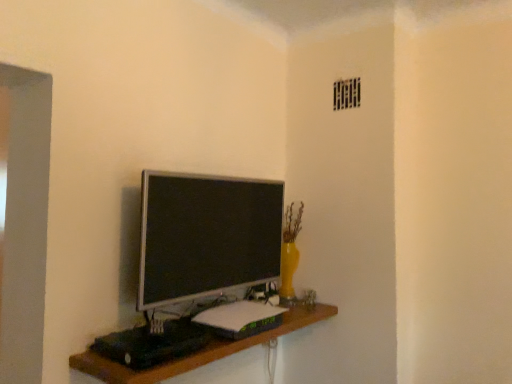
Measure the distance between point (120, 373) and camera.

They are 1.13 meters apart.

What is the approximate height of wooden shelf at center?

wooden shelf at center is 22.27 centimeters in height.

What do you see at coordinates (198, 351) in the screenshot? This screenshot has height=384, width=512. I see `wooden shelf at center` at bounding box center [198, 351].

Where is `wooden shelf at center`? wooden shelf at center is located at coordinates (198, 351).

What is the approximate width of satin silver monitor at center?

6.87 inches.

The height and width of the screenshot is (384, 512). Describe the element at coordinates (206, 236) in the screenshot. I see `satin silver monitor at center` at that location.

Where is `satin silver monitor at center`? The height and width of the screenshot is (384, 512). satin silver monitor at center is located at coordinates (206, 236).

Locate an element on the screen. Image resolution: width=512 pixels, height=384 pixels. wooden shelf at center is located at coordinates (198, 351).

Based on their positions, is wooden shelf at center located to the left or right of satin silver monitor at center?

From the image, it's evident that wooden shelf at center is to the right of satin silver monitor at center.

Looking at this image, relative to satin silver monitor at center, is wooden shelf at center in front or behind?

Clearly, wooden shelf at center is in front of satin silver monitor at center.

Which is closer to the camera, (113, 380) or (194, 200)?

Point (113, 380) is closer to the camera than point (194, 200).

From the image's perspective, does wooden shelf at center appear lower than satin silver monitor at center?

Yes.

From a real-world perspective, who is located lower, wooden shelf at center or satin silver monitor at center?

wooden shelf at center is physically lower.

Is wooden shelf at center thinner than satin silver monitor at center?

No, wooden shelf at center is not thinner than satin silver monitor at center.

Can you confirm if wooden shelf at center is taller than satin silver monitor at center?

No.

Considering the relative sizes of wooden shelf at center and satin silver monitor at center in the image provided, is wooden shelf at center smaller than satin silver monitor at center?

Actually, wooden shelf at center might be larger than satin silver monitor at center.

Is wooden shelf at center spatially inside satin silver monitor at center, or outside of it?

wooden shelf at center lies outside satin silver monitor at center.

Is wooden shelf at center positioned far away from satin silver monitor at center?

No, wooden shelf at center is not far away from satin silver monitor at center.

Could you tell me if wooden shelf at center is turned towards satin silver monitor at center?

No, wooden shelf at center is not facing towards satin silver monitor at center.

Find the location of `television above the wooden shelf at center (from the image's perspective)`. television above the wooden shelf at center (from the image's perspective) is located at coordinates (206, 236).

Considering the relative positions of satin silver monitor at center and wooden shelf at center in the image provided, is satin silver monitor at center to the left of wooden shelf at center from the viewer's perspective?

Yes, satin silver monitor at center is to the left of wooden shelf at center.

Considering their positions, is satin silver monitor at center located in front of or behind wooden shelf at center?

Clearly, satin silver monitor at center is behind wooden shelf at center.

Considering the positions of point (229, 246) and point (218, 351), is point (229, 246) closer or farther from the camera than point (218, 351)?

Point (229, 246) is farther from the camera than point (218, 351).

From the image's perspective, which is below, satin silver monitor at center or wooden shelf at center?

wooden shelf at center, from the image's perspective.

From a real-world perspective, is satin silver monitor at center positioned above or below wooden shelf at center?

Clearly, from a real-world perspective, satin silver monitor at center is above wooden shelf at center.

Which of these two, satin silver monitor at center or wooden shelf at center, is thinner?

Thinner between the two is satin silver monitor at center.

Can you confirm if satin silver monitor at center is taller than wooden shelf at center?

Yes, satin silver monitor at center is taller than wooden shelf at center.

In terms of size, does satin silver monitor at center appear bigger or smaller than wooden shelf at center?

Clearly, satin silver monitor at center is smaller in size than wooden shelf at center.

Could wooden shelf at center be considered to be inside satin silver monitor at center?

No, wooden shelf at center is not surrounded by satin silver monitor at center.

Are satin silver monitor at center and wooden shelf at center making contact?

No.

Is satin silver monitor at center positioned with its back to wooden shelf at center?

No, wooden shelf at center is not at the back of satin silver monitor at center.

How different are the orientations of satin silver monitor at center and wooden shelf at center in degrees?

satin silver monitor at center and wooden shelf at center are facing 0.0786 degrees away from each other.

Measure the distance from satin silver monitor at center to wooden shelf at center.

satin silver monitor at center and wooden shelf at center are 33.64 centimeters apart from each other.

Find the location of a particular element. The image size is (512, 384). shelf beneath the satin silver monitor at center (from a real-world perspective) is located at coordinates coord(198,351).

Where is `television positioned vertically above the wooden shelf at center (from a real-world perspective)`? The image size is (512, 384). television positioned vertically above the wooden shelf at center (from a real-world perspective) is located at coordinates (206, 236).

Where is `shelf that is on the right side of satin silver monitor at center`? This screenshot has width=512, height=384. shelf that is on the right side of satin silver monitor at center is located at coordinates (198, 351).